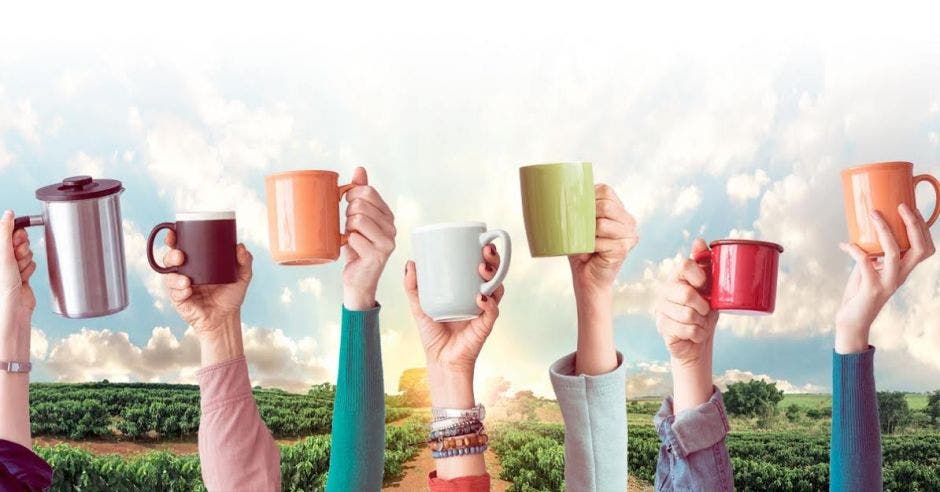
The image size is (940, 492). Find the location of `mugs`. mugs is located at coordinates (71, 256), (221, 263), (333, 224), (446, 274), (572, 212), (739, 278), (870, 189).